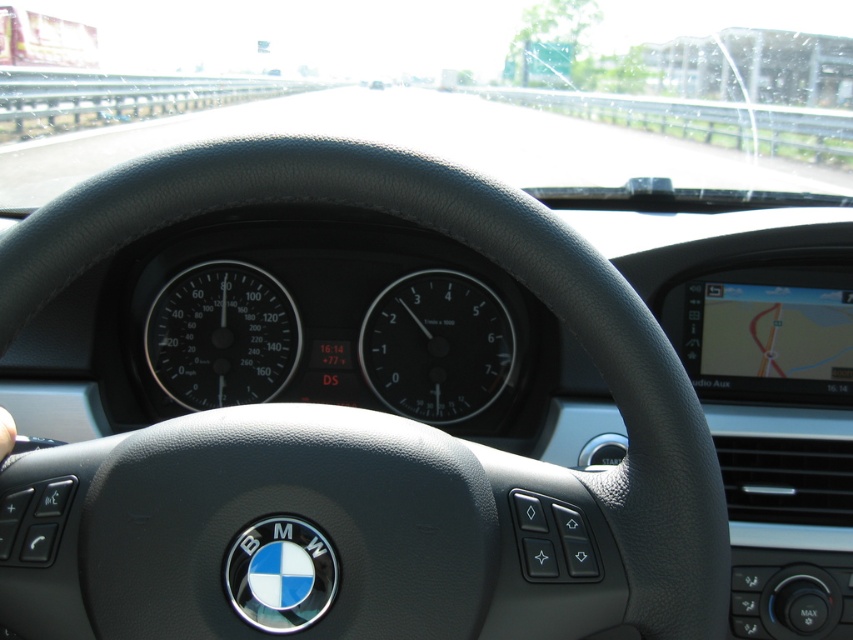
You are sitting in the driver seat of the BMW. You want to check the speedometer, which is located between the transparent glass windshield at upper center and the black glass tachometer at center. Which object is closer to you so you don not have to stretch your neck too much to see it?

The transparent glass windshield at upper center is closer to the viewer than the black glass tachometer at center, so you can check the speedometer without stretching your neck too much by looking towards the transparent glass windshield at upper center.

You are sitting in the driver seat of the BMW vehicle. There is a point at coordinates (436,346) on the dashboard. Can you tell me what object is located at that point?

The point at coordinates (436,346) corresponds to the black glass tachometer at center.

In the scene shown: You are sitting in the driver seat of the BMW vehicle. You need to check the speedometer and then look ahead through the windshield. Which object will you look at first, the transparent glass windshield at upper center or the black matte speedometer at center?

You will look at the black matte speedometer at center first because the transparent glass windshield at upper center is located to the left of it, meaning the speedometer is more to the right and thus in the direct line of sight from the driver seat.